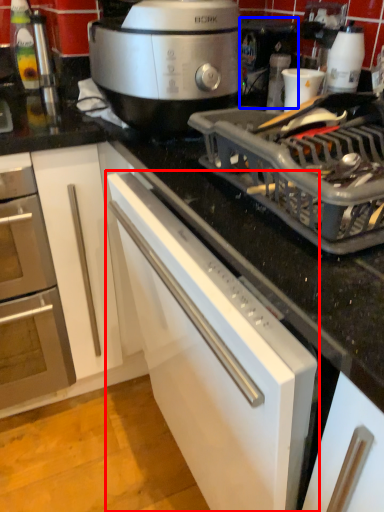
Question: Which object is closer to the camera taking this photo, cabinetry (highlighted by a red box) or coffee machine (highlighted by a blue box)?

Choices:
 (A) cabinetry
 (B) coffee machine

Answer: (A)